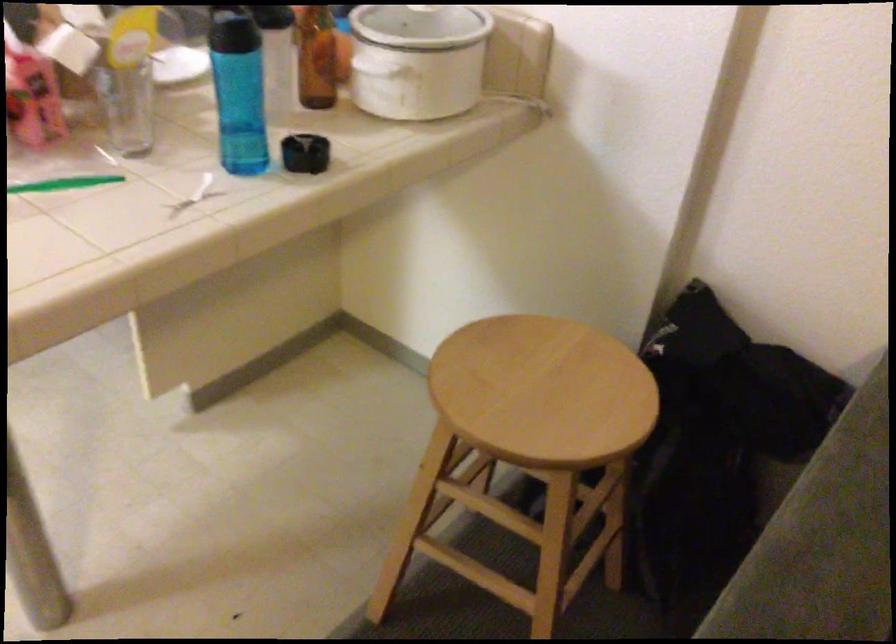
At what (x,y) coordinates should I click in order to perform the action: click on clear drinking glass. Please return your answer as a coordinate pair (x, y). Looking at the image, I should click on [x=127, y=106].